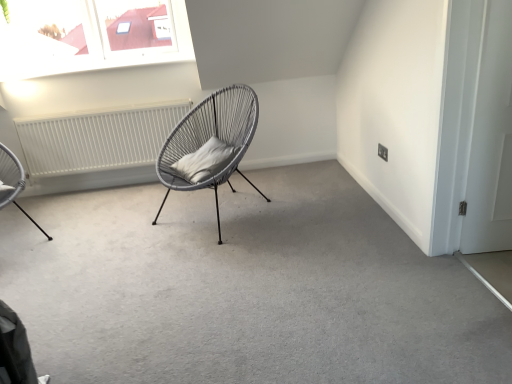
You are a GUI agent. You are given a task and a screenshot of the screen. Output one action in this format:
    pyautogui.click(x=<x>, y=<y>)
    Task: Click on the free spot to the right of metallic wire chair at left, which is the 1th chair from left to right
    
    Given the screenshot: What is the action you would take?
    pyautogui.click(x=83, y=227)